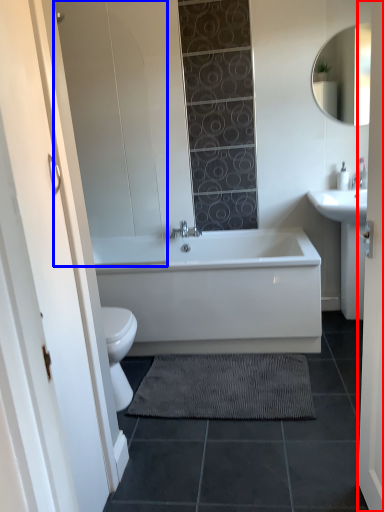
Question: Among these objects, which one is farthest to the camera, door (highlighted by a red box) or glass door (highlighted by a blue box)?

Choices:
 (A) door
 (B) glass door

Answer: (B)